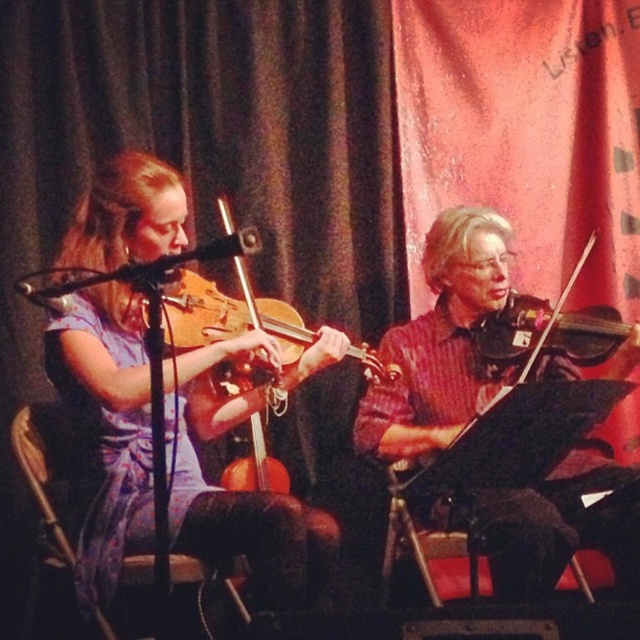
Question: Estimate the real-world distances between objects in this image. Which object is closer to the matte wood violin at left?

Choices:
 (A) matte black violin at center
 (B) wooden violin at left

Answer: (B)

Question: Considering the relative positions of matte wood violin at left and matte black violin at center in the image provided, where is matte wood violin at left located with respect to matte black violin at center?

Choices:
 (A) right
 (B) left

Answer: (B)

Question: Which object is the closest to the matte wood violin at left?

Choices:
 (A) matte black violin at center
 (B) wooden violin at left

Answer: (B)

Question: Which object is the farthest from the matte wood violin at left?

Choices:
 (A) matte black violin at center
 (B) wooden violin at left

Answer: (A)

Question: Is matte black violin at center further to the viewer compared to wooden violin at left?

Choices:
 (A) yes
 (B) no

Answer: (A)

Question: Is matte wood violin at left below wooden violin at left?

Choices:
 (A) no
 (B) yes

Answer: (B)